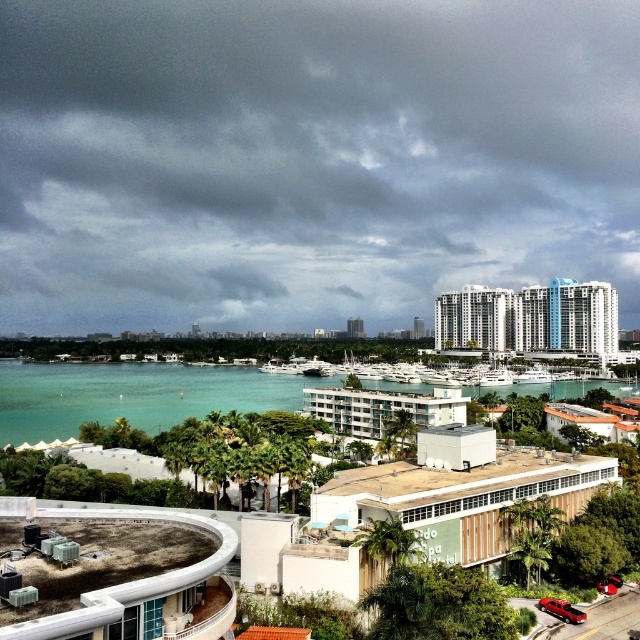
Between dark gray cloud at upper center and white glossy building at center, which one is positioned lower?

white glossy building at center is below.

Between dark gray cloud at upper center and white glossy building at center, which one appears on the right side from the viewer's perspective?

white glossy building at center is more to the right.

Image resolution: width=640 pixels, height=640 pixels. Identify the location of dark gray cloud at upper center. (308, 157).

Can you confirm if concrete roof at lower left is positioned above white glossy building at upper right?

No, concrete roof at lower left is not above white glossy building at upper right.

In the scene shown: Between concrete roof at lower left and white glossy building at upper right, which one appears on the left side from the viewer's perspective?

concrete roof at lower left

Which is behind, point (93, 593) or point (497, 289)?

Point (497, 289)

At what (x,y) coordinates should I click in order to perform the action: click on concrete roof at lower left. Please return your answer as a coordinate pair (x, y). Looking at the image, I should click on (115, 573).

Can you confirm if dark gray cloud at upper center is positioned above beige wooden building at center?

Indeed, dark gray cloud at upper center is positioned over beige wooden building at center.

Does point (419, 40) come farther from viewer compared to point (348, 515)?

Yes.

What do you see at coordinates (308, 157) in the screenshot?
I see `dark gray cloud at upper center` at bounding box center [308, 157].

Image resolution: width=640 pixels, height=640 pixels. I want to click on dark gray cloud at upper center, so click(308, 157).